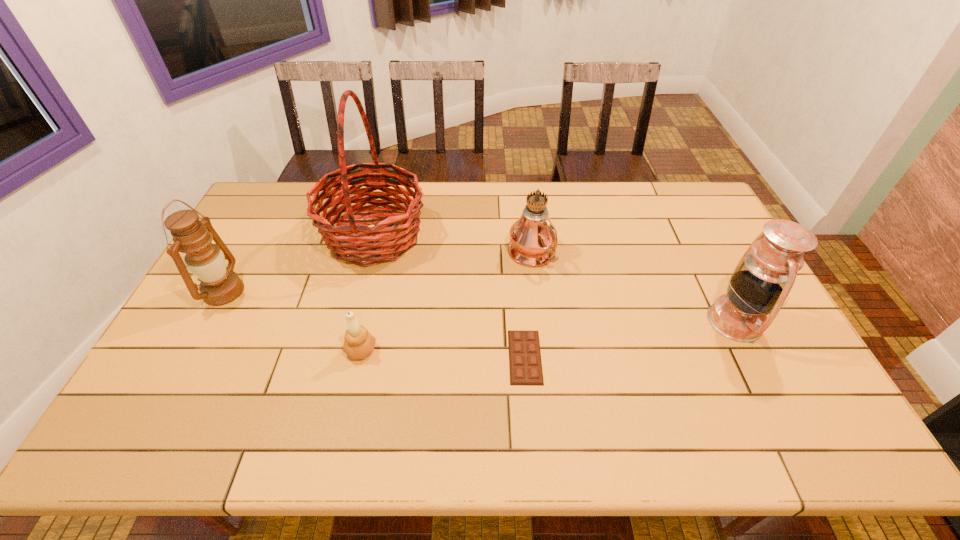
Where is `object identified as the fifth closest to the basket`? This screenshot has width=960, height=540. object identified as the fifth closest to the basket is located at coordinates tap(763, 278).

The image size is (960, 540). Identify the location of object that can be found as the third closest to the leftmost oil lamp. (525, 365).

Find the location of a particular element. This screenshot has height=540, width=960. oil lamp that is the second nearest to the basket is located at coordinates (533, 238).

Locate which oil lamp ranks in proximity to the tallest object. Please provide its 2D coordinates. Your answer should be formatted as a tuple, i.e. [(x, y)], where the tuple contains the x and y coordinates of a point satisfying the conditions above.

[(205, 260)]

I want to click on vacant area in the image that satisfies the following two spatial constraints: 1. on the handle side of the tallest object; 2. on the back side of the rightmost oil lamp, so click(x=351, y=321).

Locate an element on the screen. This screenshot has height=540, width=960. vacant space that satisfies the following two spatial constraints: 1. on the handle side of the tallest object; 2. on the left side of the shortest object is located at coordinates (343, 357).

Find the location of a particular element. vacant space that satisfies the following two spatial constraints: 1. on the front side of the rightmost oil lamp; 2. on the right side of the leftmost object is located at coordinates (207, 321).

The image size is (960, 540). Identify the location of vacant point that satisfies the following two spatial constraints: 1. on the handle side of the rightmost object; 2. on the right side of the tallest object. (351, 321).

The width and height of the screenshot is (960, 540). In order to click on free space that satisfies the following two spatial constraints: 1. on the back side of the second tallest object; 2. on the left side of the leftmost oil lamp in this screenshot , I will do `click(244, 254)`.

I want to click on free location that satisfies the following two spatial constraints: 1. on the handle side of the chocolate bar; 2. on the left side of the tallest object, so click(x=343, y=357).